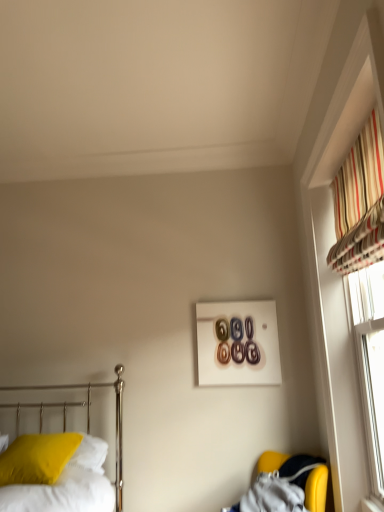
Question: Is yellow fabric armchair at lower right outside matte yellow pillow at lower left?

Choices:
 (A) yes
 (B) no

Answer: (A)

Question: Could you tell me if yellow fabric armchair at lower right is turned towards matte yellow pillow at lower left?

Choices:
 (A) yes
 (B) no

Answer: (A)

Question: Can you confirm if yellow fabric armchair at lower right is thinner than matte yellow pillow at lower left?

Choices:
 (A) yes
 (B) no

Answer: (B)

Question: From a real-world perspective, is yellow fabric armchair at lower right located beneath matte yellow pillow at lower left?

Choices:
 (A) yes
 (B) no

Answer: (A)

Question: Is yellow fabric armchair at lower right oriented away from matte yellow pillow at lower left?

Choices:
 (A) yes
 (B) no

Answer: (B)

Question: Looking at their shapes, would you say metallic bed at left is wider or thinner than matte yellow pillow at lower left?

Choices:
 (A) wide
 (B) thin

Answer: (A)

Question: Relative to matte yellow pillow at lower left, is metallic bed at left in front or behind?

Choices:
 (A) behind
 (B) front

Answer: (B)

Question: Considering the positions of point (74, 385) and point (39, 451), is point (74, 385) closer or farther from the camera than point (39, 451)?

Choices:
 (A) closer
 (B) farther

Answer: (B)

Question: From their relative heights in the image, would you say metallic bed at left is taller or shorter than matte yellow pillow at lower left?

Choices:
 (A) short
 (B) tall

Answer: (B)

Question: From the image's perspective, is striped fabric at upper right above or below yellow fabric armchair at lower right?

Choices:
 (A) below
 (B) above

Answer: (B)

Question: Considering the positions of point (339, 215) and point (304, 480), is point (339, 215) closer or farther from the camera than point (304, 480)?

Choices:
 (A) farther
 (B) closer

Answer: (B)

Question: Considering their positions, is striped fabric at upper right located in front of or behind yellow fabric armchair at lower right?

Choices:
 (A) front
 (B) behind

Answer: (A)

Question: From their relative heights in the image, would you say striped fabric at upper right is taller or shorter than yellow fabric armchair at lower right?

Choices:
 (A) tall
 (B) short

Answer: (A)

Question: From a real-world perspective, is matte yellow pillow at lower left positioned above or below metallic bed at left?

Choices:
 (A) below
 (B) above

Answer: (A)

Question: From the image's perspective, is matte yellow pillow at lower left positioned above or below metallic bed at left?

Choices:
 (A) above
 (B) below

Answer: (B)